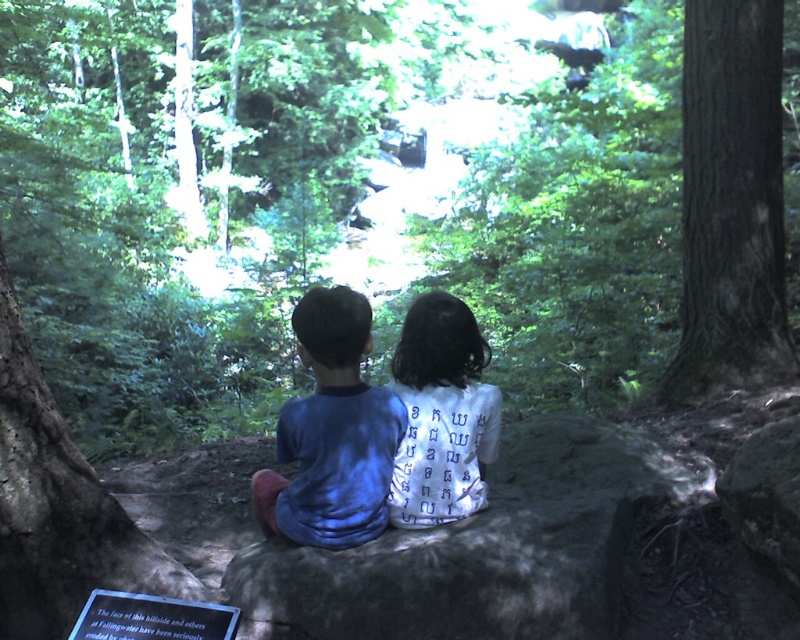
Is smooth brown bark at right to the right of white fabric shirt at center from the viewer's perspective?

Correct, you'll find smooth brown bark at right to the right of white fabric shirt at center.

Is smooth brown bark at right below white fabric shirt at center?

Actually, smooth brown bark at right is above white fabric shirt at center.

Does point (688, 340) come behind point (430, 472)?

Yes, point (688, 340) is behind point (430, 472).

Identify the location of smooth brown bark at right. (732, 204).

Does smooth brown bark at right come in front of blue cotton shirt at center?

No.

Does smooth brown bark at right appear on the right side of blue cotton shirt at center?

Correct, you'll find smooth brown bark at right to the right of blue cotton shirt at center.

Does point (694, 285) come in front of point (326, 470)?

That is False.

This screenshot has width=800, height=640. Identify the location of smooth brown bark at right. (732, 204).

Who is shorter, blue cotton shirt at center or white fabric shirt at center?

Standing shorter between the two is white fabric shirt at center.

Who is more forward, (350, 445) or (448, 440)?

Point (350, 445) is in front.

Who is more forward, (338, 513) or (394, 481)?

Positioned in front is point (338, 513).

Image resolution: width=800 pixels, height=640 pixels. In order to click on blue cotton shirt at center in this screenshot , I will do `click(332, 433)`.